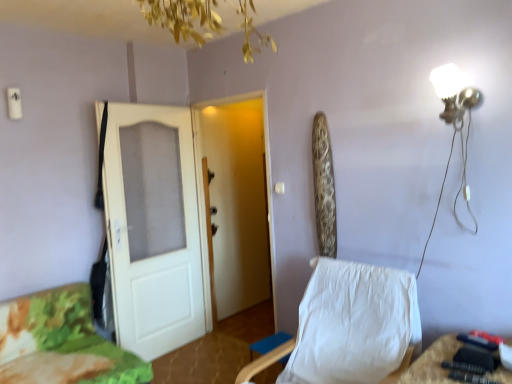
Find the location of `white fabric chair at center`. white fabric chair at center is located at coordinates (348, 325).

The height and width of the screenshot is (384, 512). What do you see at coordinates (186, 218) in the screenshot?
I see `white matte door at left, arranged as the 2th door when viewed from the right` at bounding box center [186, 218].

Locate an element on the screen. camouflage fabric bed at lower left is located at coordinates (61, 342).

Considering the positions of point (455, 125) and point (242, 115), is point (455, 125) closer or farther from the camera than point (242, 115)?

Point (455, 125) is closer to the camera than point (242, 115).

Is white glossy wall lamp at upper right turned away from white wooden door at center, the 1th door positioned from the right?

No, white wooden door at center, the 1th door positioned from the right, is not at the back of white glossy wall lamp at upper right.

Is white glossy wall lamp at upper right situated inside white wooden door at center, the 1th door positioned from the right, or outside?

The correct answer is: outside.

In the scene shown: Considering the relative sizes of camouflage fabric bed at lower left and white wooden door at center, the 1th door positioned from the right, in the image provided, is camouflage fabric bed at lower left taller than white wooden door at center, the 1th door positioned from the right,?

Incorrect, the height of camouflage fabric bed at lower left is not larger of that of white wooden door at center, the 1th door positioned from the right.

From a real-world perspective, which is physically above, camouflage fabric bed at lower left or white wooden door at center, the 1th door positioned from the right?

white wooden door at center, the 1th door positioned from the right.

Is point (57, 372) positioned after point (203, 142)?

No, (57, 372) is in front of (203, 142).

In the scene shown: Is camouflage fabric bed at lower left at the right side of white wooden door at center, the 1th door positioned from the right?

In fact, camouflage fabric bed at lower left is to the left of white wooden door at center, the 1th door positioned from the right.

You are a GUI agent. You are given a task and a screenshot of the screen. Output one action in this format:
    pyautogui.click(x=<x>, y=<y>)
    Task: Click on the door that is under the white wooden door at center, the 1th door positioned from the right (from a real-world perspective)
    This screenshot has width=512, height=384.
    Given the screenshot: What is the action you would take?
    pyautogui.click(x=186, y=218)

Is white matte door at left, arranged as the 2th door when viewed from the right, further to camera compared to white wooden door at center, arranged as the 2th door when viewed from the left?

No, the depth of white matte door at left, arranged as the 2th door when viewed from the right, is less than that of white wooden door at center, arranged as the 2th door when viewed from the left.

Considering the sizes of objects white matte door at left, which appears as the 1th door when viewed from the left, and white wooden door at center, arranged as the 2th door when viewed from the left, in the image provided, who is wider, white matte door at left, which appears as the 1th door when viewed from the left, or white wooden door at center, arranged as the 2th door when viewed from the left,?

white wooden door at center, arranged as the 2th door when viewed from the left, is wider.

Is white fabric chair at center located outside white wooden door at center, the 1th door positioned from the right?

white fabric chair at center lies outside white wooden door at center, the 1th door positioned from the right,'s area.

From the image's perspective, starting from the white fabric chair at center, which door is the 2nd one above? Please provide its 2D coordinates.

[(238, 202)]

From a real-world perspective, is white fabric chair at center over white wooden door at center, arranged as the 2th door when viewed from the left?

Actually, white fabric chair at center is physically below white wooden door at center, arranged as the 2th door when viewed from the left, in the real world.

Is white fabric chair at center in front of white wooden door at center, arranged as the 2th door when viewed from the left?

Yes, white fabric chair at center is closer to the camera.

Is camouflage fabric bed at lower left wider or thinner than white glossy wall lamp at upper right?

In the image, camouflage fabric bed at lower left appears to be wider than white glossy wall lamp at upper right.

The height and width of the screenshot is (384, 512). Find the location of `furniture that appears below the white glossy wall lamp at upper right (from the image's perspective)`. furniture that appears below the white glossy wall lamp at upper right (from the image's perspective) is located at coordinates (61, 342).

Consider the image. Which is closer to the camera, [11,347] or [467,229]?

Point [11,347] is positioned farther from the camera compared to point [467,229].

From a real-world perspective, is camouflage fabric bed at lower left physically located above or below white glossy wall lamp at upper right?

In terms of real-world spatial position, camouflage fabric bed at lower left is below white glossy wall lamp at upper right.

From a real-world perspective, is white glossy wall lamp at upper right under white fabric chair at center?

No.

Which is in front, white glossy wall lamp at upper right or white fabric chair at center?

Positioned in front is white fabric chair at center.

Looking at this image, considering the relative sizes of white glossy wall lamp at upper right and white fabric chair at center in the image provided, is white glossy wall lamp at upper right shorter than white fabric chair at center?

Correct, white glossy wall lamp at upper right is not as tall as white fabric chair at center.

How many degrees apart are the facing directions of white glossy wall lamp at upper right and white matte door at left, which appears as the 1th door when viewed from the left?

The facing directions of white glossy wall lamp at upper right and white matte door at left, which appears as the 1th door when viewed from the left, are 93.7 degrees apart.

Between white glossy wall lamp at upper right and white matte door at left, arranged as the 2th door when viewed from the right, which one has smaller size?

Smaller between the two is white glossy wall lamp at upper right.

Which is correct: white glossy wall lamp at upper right is inside white matte door at left, arranged as the 2th door when viewed from the right, or outside of it?

white glossy wall lamp at upper right is located beyond the bounds of white matte door at left, arranged as the 2th door when viewed from the right.

Where is `table lamp in front of the white wooden door at center, the 1th door positioned from the right`? The image size is (512, 384). table lamp in front of the white wooden door at center, the 1th door positioned from the right is located at coordinates (457, 117).

You are a GUI agent. You are given a task and a screenshot of the screen. Output one action in this format:
    pyautogui.click(x=<x>, y=<y>)
    Task: Click on the furniture beneath the white wooden door at center, arranged as the 2th door when viewed from the left (from a real-world perspective)
    
    Given the screenshot: What is the action you would take?
    pyautogui.click(x=61, y=342)

Looking at the image, which one is located closer to white glossy wall lamp at upper right, white fabric chair at center or white wooden door at center, arranged as the 2th door when viewed from the left?

white fabric chair at center.

Based on their spatial positions, is white matte door at left, arranged as the 2th door when viewed from the right, or camouflage fabric bed at lower left closer to white wooden door at center, the 1th door positioned from the right?

white matte door at left, arranged as the 2th door when viewed from the right.

Estimate the real-world distances between objects in this image. Which object is closer to camouflage fabric bed at lower left, white fabric chair at center or white glossy wall lamp at upper right?

Among the two, white fabric chair at center is located nearer to camouflage fabric bed at lower left.

When comparing their distances from white wooden door at center, arranged as the 2th door when viewed from the left, does camouflage fabric bed at lower left or white glossy wall lamp at upper right seem further?

white glossy wall lamp at upper right is positioned further to the anchor white wooden door at center, arranged as the 2th door when viewed from the left.

Estimate the real-world distances between objects in this image. Which object is further from camouflage fabric bed at lower left, white matte door at left, which appears as the 1th door when viewed from the left, or white fabric chair at center?

white fabric chair at center is positioned further to the anchor camouflage fabric bed at lower left.

When comparing their distances from white glossy wall lamp at upper right, does white matte door at left, which appears as the 1th door when viewed from the left, or white wooden door at center, the 1th door positioned from the right, seem closer?

white matte door at left, which appears as the 1th door when viewed from the left, lies closer to white glossy wall lamp at upper right than the other object.

Estimate the real-world distances between objects in this image. Which object is closer to white wooden door at center, the 1th door positioned from the right, camouflage fabric bed at lower left or white matte door at left, arranged as the 2th door when viewed from the right?

Among the two, white matte door at left, arranged as the 2th door when viewed from the right, is located nearer to white wooden door at center, the 1th door positioned from the right.

Based on their spatial positions, is white wooden door at center, the 1th door positioned from the right, or white fabric chair at center further from camouflage fabric bed at lower left?

The object further to camouflage fabric bed at lower left is white wooden door at center, the 1th door positioned from the right.

The height and width of the screenshot is (384, 512). Identify the location of chair between camouflage fabric bed at lower left and white glossy wall lamp at upper right. (348, 325).

Locate an element on the screen. The image size is (512, 384). door located between white fabric chair at center and white wooden door at center, the 1th door positioned from the right, in the depth direction is located at coordinates (186, 218).

Identify the location of door between camouflage fabric bed at lower left and white wooden door at center, arranged as the 2th door when viewed from the left, along the z-axis. The image size is (512, 384). point(186,218).

In order to click on door between white matte door at left, which appears as the 1th door when viewed from the left, and white glossy wall lamp at upper right from left to right in this screenshot , I will do `click(238, 202)`.